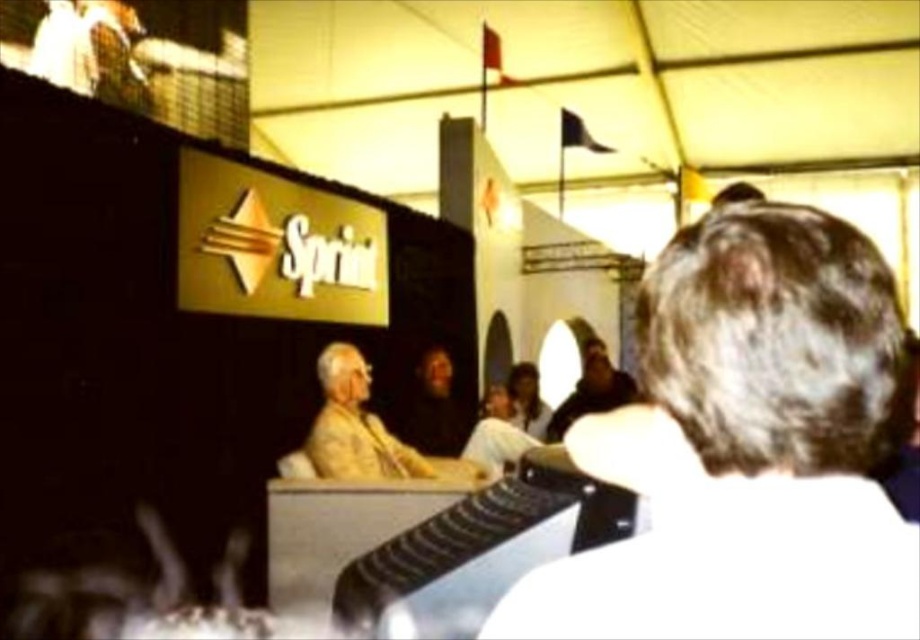
Question: Which point is closer to the camera taking this photo?

Choices:
 (A) (366, 378)
 (B) (837, 388)
 (C) (605, 404)

Answer: (B)

Question: Which point appears farthest from the camera in this image?

Choices:
 (A) (788, 288)
 (B) (362, 458)
 (C) (616, 385)

Answer: (C)

Question: Which of the following is the closest to the observer?

Choices:
 (A) dark brown leather jacket at center
 (B) white matte hair at upper right
 (C) yellow fabric at center

Answer: (B)

Question: Does white matte hair at upper right appear on the right side of yellow fabric at center?

Choices:
 (A) yes
 (B) no

Answer: (A)

Question: Does white matte hair at upper right have a smaller size compared to yellow fabric at center?

Choices:
 (A) no
 (B) yes

Answer: (B)

Question: Does white matte hair at upper right have a greater width compared to yellow fabric at center?

Choices:
 (A) yes
 (B) no

Answer: (B)